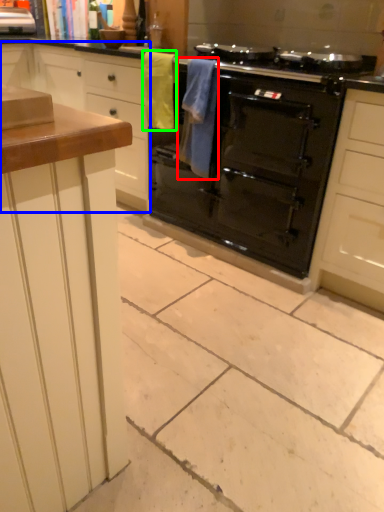
Question: Based on their relative distances, which object is farther from material (highlighted by a red box)? Choose from cabinetry (highlighted by a blue box) and material (highlighted by a green box).

Choices:
 (A) cabinetry
 (B) material

Answer: (A)